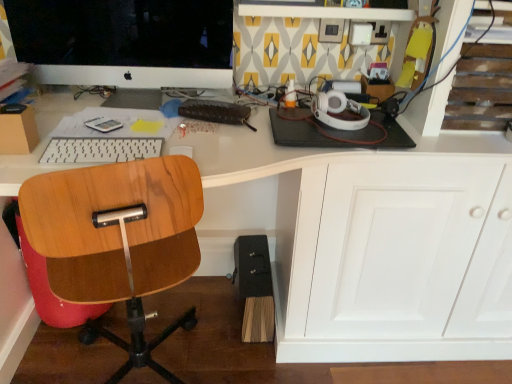
Question: Relative to wooden chair at left, is matte black monitor at upper left in front or behind?

Choices:
 (A) front
 (B) behind

Answer: (B)

Question: From the image's perspective, is matte black monitor at upper left above or below wooden chair at left?

Choices:
 (A) below
 (B) above

Answer: (B)

Question: Which object is the closest to the wooden chair at left?

Choices:
 (A) white plastic keyboard at center
 (B) white glossy desk at center
 (C) matte black monitor at upper left

Answer: (A)

Question: Which is farther from the white glossy desk at center?

Choices:
 (A) white plastic keyboard at center
 (B) matte black monitor at upper left
 (C) wooden chair at left

Answer: (A)